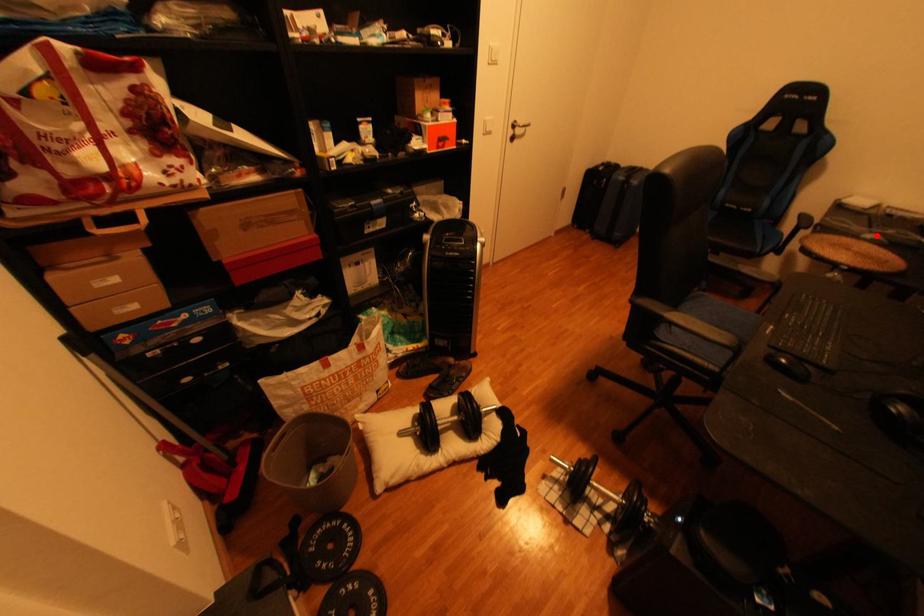
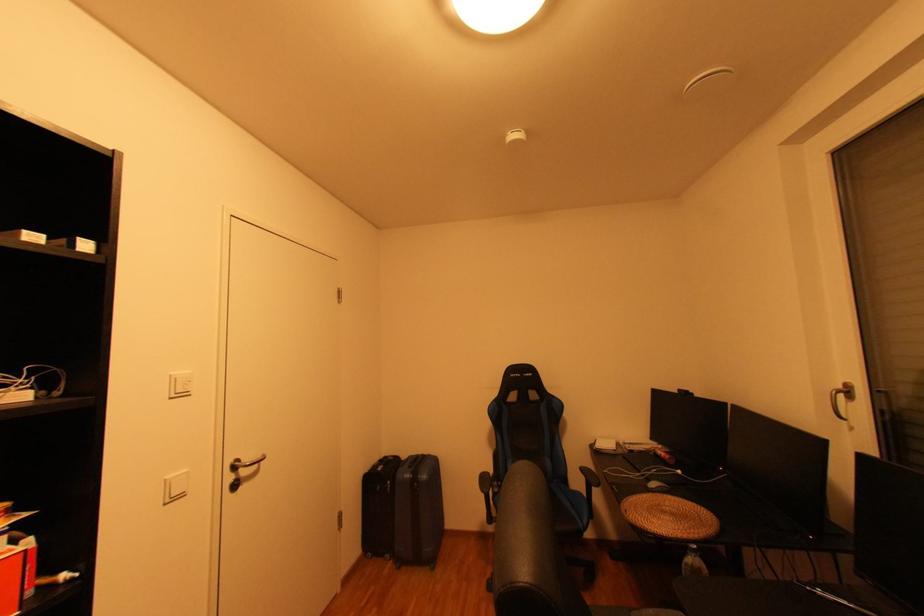
Question: I am providing you with two images of the same scene from different viewpoints. In image1, a red point is highlighted. Considering the same 3D point in image2, which of the following is correct?

Choices:
 (A) It is closer
 (B) It is farther

Answer: (A)